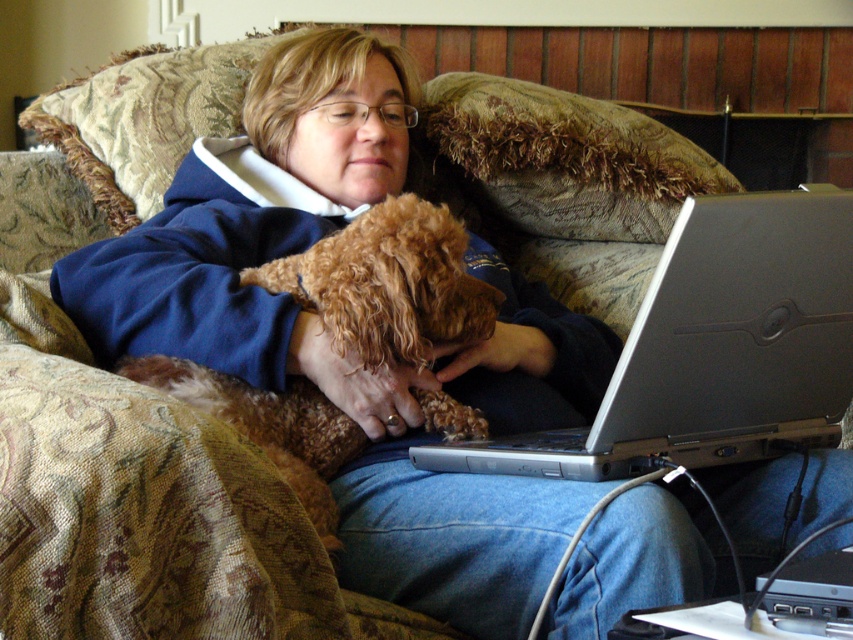
You are organizing a space for a pet owner who wants to ensure their dog has enough room to move around. The brown curly fur dog at center is currently near the silver metallic laptop at lower right. Based on the scene, can the dog comfortably move around without bumping into the laptop?

The silver metallic laptop at lower right might be wider than brown curly fur dog at center, so there could be a risk of the dog bumping into the laptop if they move around. It would be safer to give them more space.

You are a delivery robot trying to reach the silver metallic laptop at lower right. There is a brown curly fur dog at center in the way. Can you move the dog to access the laptop?

The silver metallic laptop at lower right is below the brown curly fur dog at center, so the dog is blocking access to the laptop. You will need to move the dog to reach the laptop.